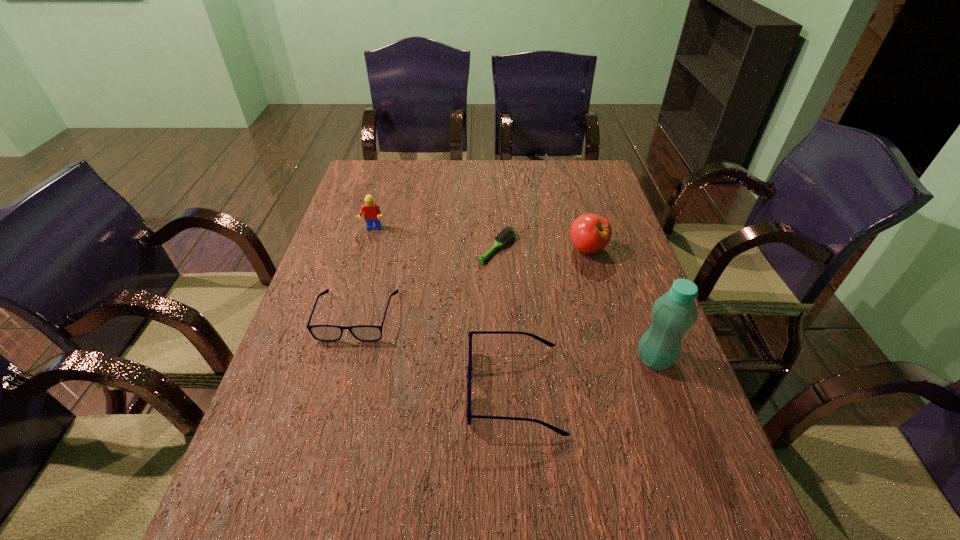
The image size is (960, 540). I want to click on free space for a new spectacles on the right, so click(733, 491).